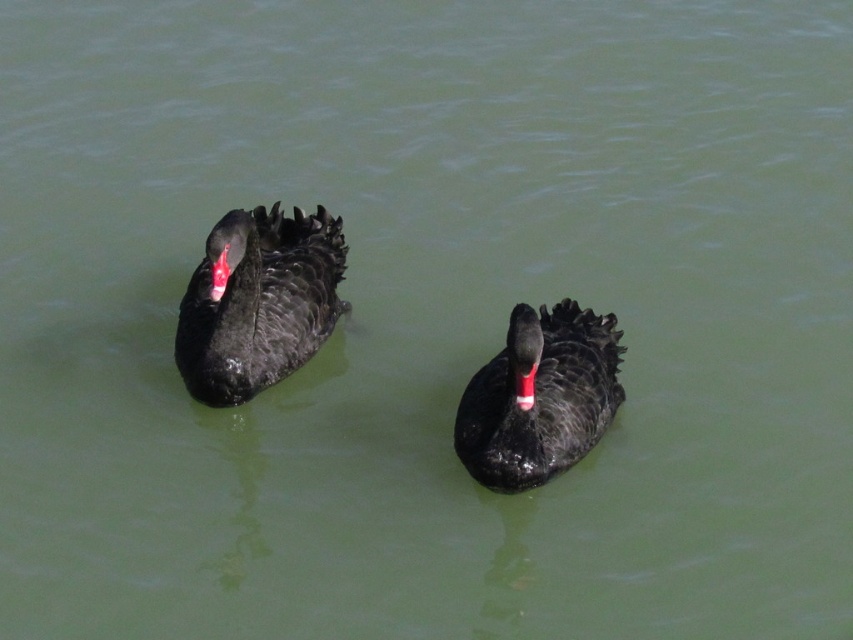
You are a wildlife photographer trying to capture a clear photo of both the matte black swan at left and the matte black duck at center. Since you want to focus on the taller bird, which one should you adjust your camera settings for?

The matte black swan at left is taller than the matte black duck at center, so you should adjust your camera settings to focus on the matte black swan at left.

You are a birdwatcher observing two waterfowl on a lake. You see a matte black swan at left and a matte black duck at center. Which one is positioned higher in the image?

The matte black swan at left is positioned higher in the image than the matte black duck at center.

Based on the photo, you are a wildlife photographer aiming to capture a closeup shot of the matte black swan at left and the matte black duck at center. Since you want to focus on the larger bird, which one should you choose?

The matte black swan at left is bigger than the matte black duck at center, so you should focus on the matte black swan at left for the closeup shot.